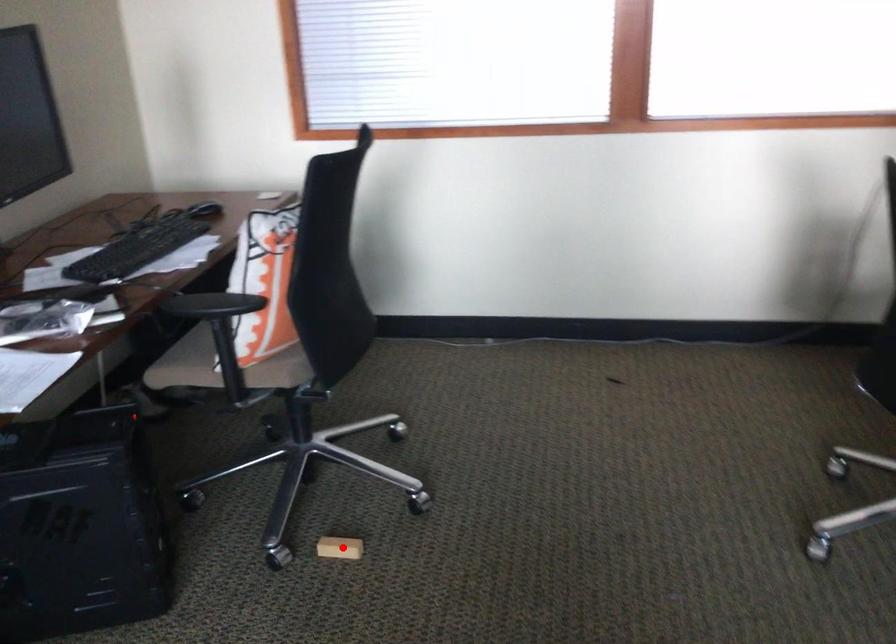
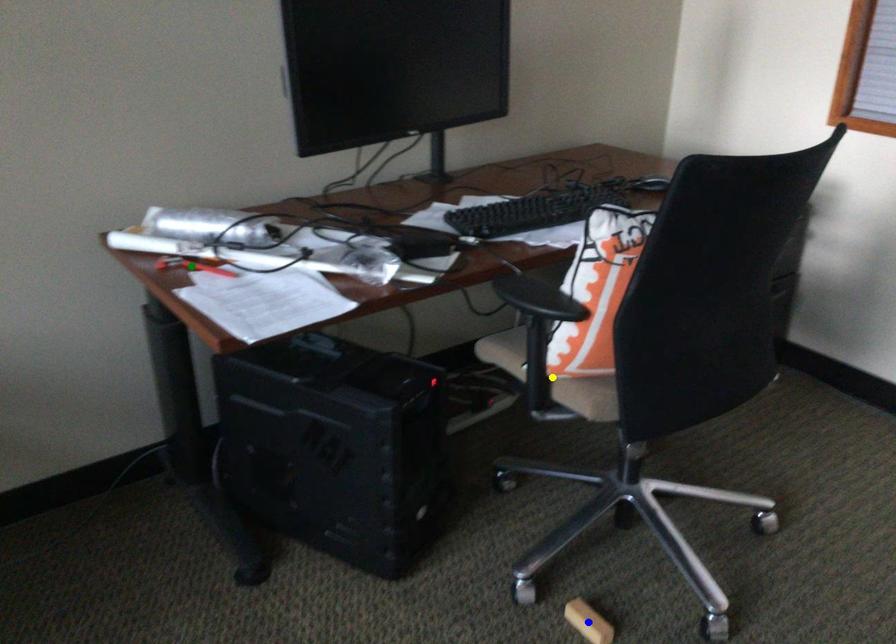
Question: I am providing you with two images of the same scene from different viewpoints. A red point is marked on the first image. You are given multiple points on the second image. Which point in image 2 represents the same 3d spot as the red point in image 1?

Choices:
 (A) yellow point
 (B) green point
 (C) blue point

Answer: (C)